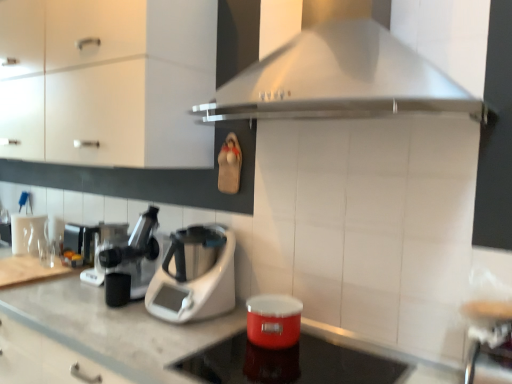
I want to click on free space in front of white plastic food processor at center, so click(163, 337).